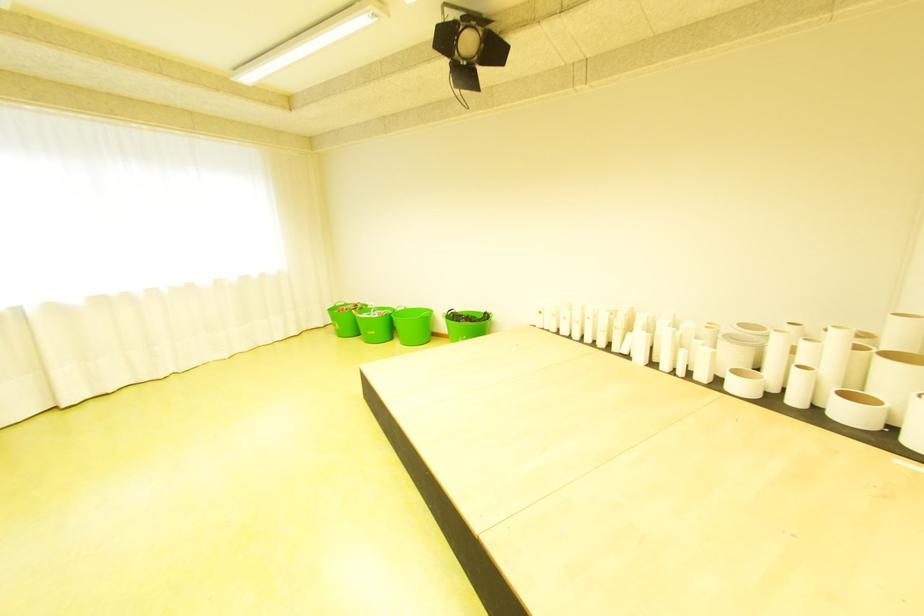
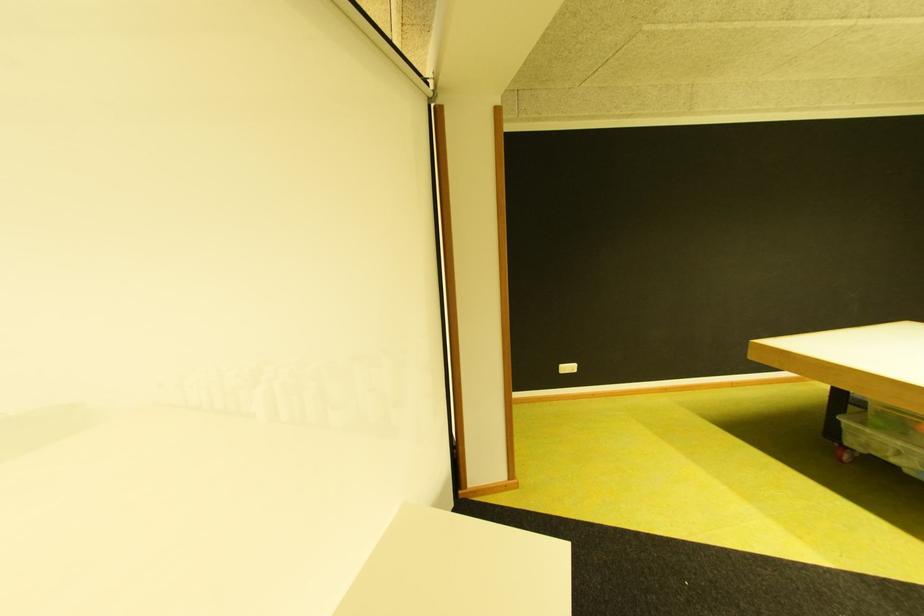
Question: How did the camera likely rotate?

Choices:
 (A) Left
 (B) Right
 (C) Up
 (D) Down

Answer: (B)